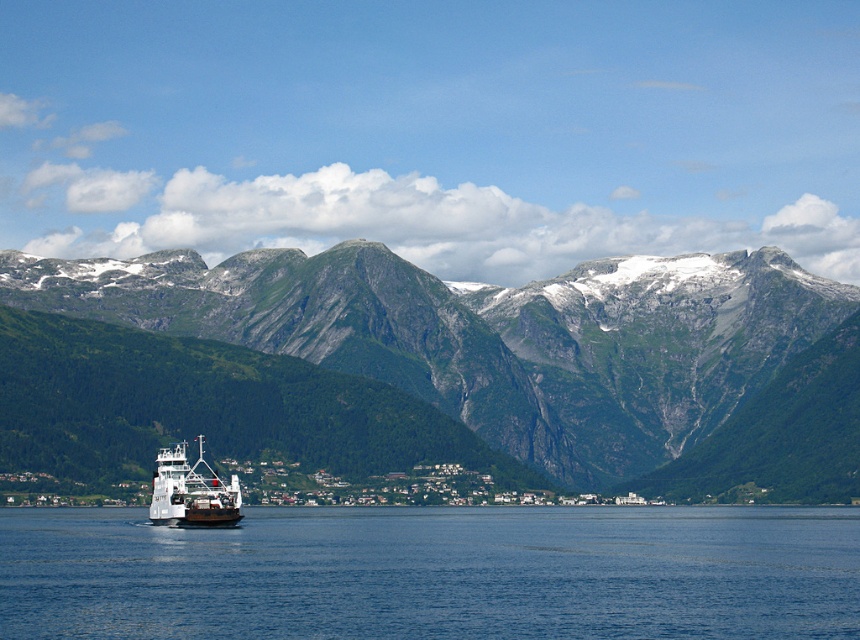
Question: Among these points, which one is nearest to the camera?

Choices:
 (A) (97, 275)
 (B) (200, 490)
 (C) (183, 547)

Answer: (B)

Question: Which of the following is the closest to the observer?

Choices:
 (A) green rocky mountain range at center
 (B) blue water at center
 (C) white matte ferry at lower left
 (D) green rocky mountains at upper center

Answer: (A)

Question: Does green rocky mountain range at center lie in front of white matte ferry at lower left?

Choices:
 (A) yes
 (B) no

Answer: (A)

Question: Among these points, which one is nearest to the camera?

Choices:
 (A) (250, 595)
 (B) (840, 161)
 (C) (220, 493)
 (D) (449, 380)

Answer: (D)

Question: Can you confirm if green rocky mountains at upper center is positioned above green rocky mountain range at center?

Choices:
 (A) no
 (B) yes

Answer: (B)

Question: Can you confirm if green rocky mountain range at center is positioned to the left of blue water at center?

Choices:
 (A) yes
 (B) no

Answer: (B)